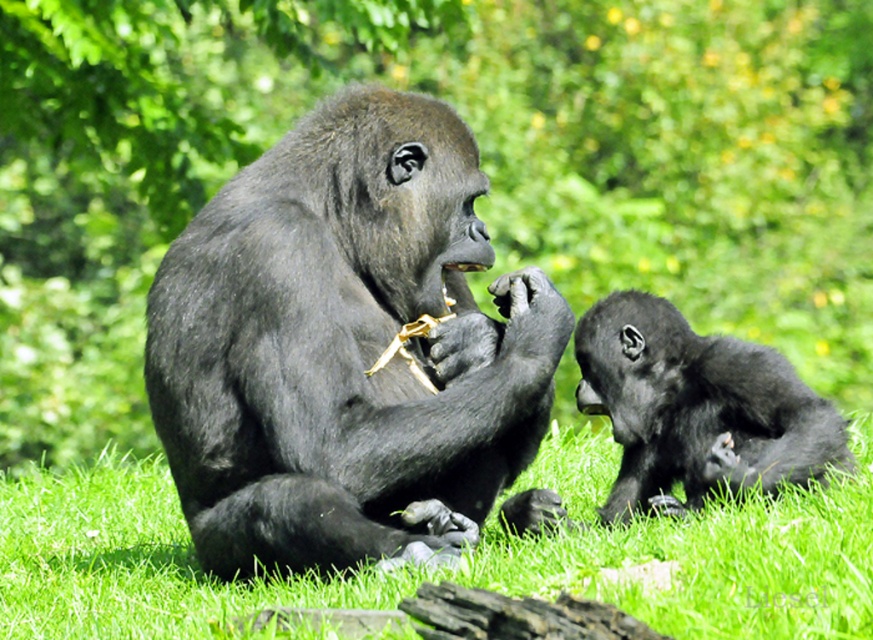
Consider the image. You are a wildlife photographer standing at the point marked as point (691, 88). You want to take a photo of the two gorillas. Can you fit both gorillas in your camera frame if your camera has a maximum viewing angle of 120 degrees?

The two gorillas are 10.96 meters apart. To determine if they can fit in the camera frame with a 120 degree viewing angle, we can calculate the distance between them relative to the photographer. However, without knowing the distance from the photographer to the gorillas, it is impossible to accurately determine if they fit within the 120 degree angle. Additional information about the distance from the photographer to the subjects is required to make this calculation.

You are a wildlife photographer aiming to capture a closeup of the shiny black gorilla at center. Your camera has a minimum focusing distance of 4 meters. Can you take the photo without moving closer than 4 meters?

The shiny black gorilla at center is 3.88 meters from camera, so you cannot take the photo without moving closer than 4 meters because the distance is less than the required focusing distance.